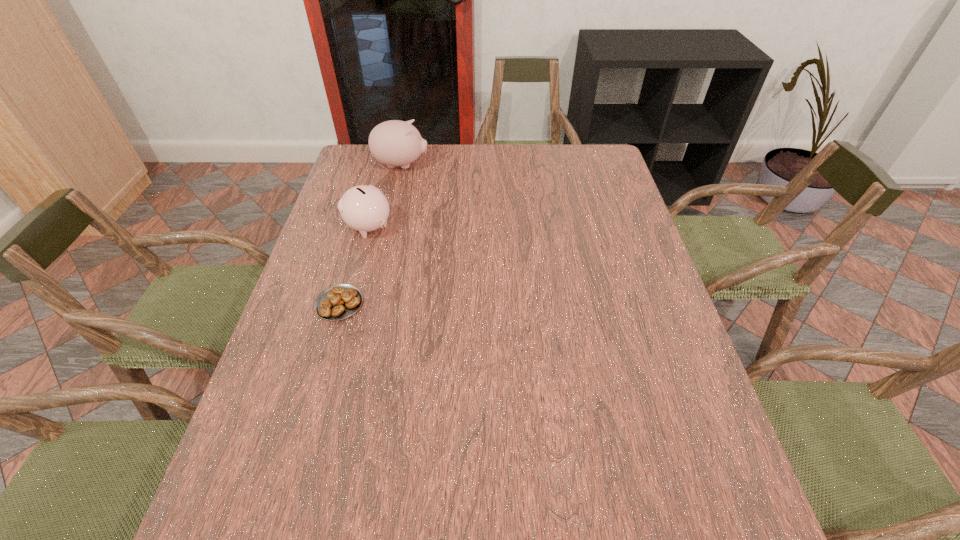
The width and height of the screenshot is (960, 540). Identify the location of vacant space that is in between the second tallest object and the pastry. (354, 265).

This screenshot has width=960, height=540. Find the location of `object that is the second closest to the shortest object`. object that is the second closest to the shortest object is located at coordinates (394, 143).

Choose which object is the nearest neighbor to the second farthest object. Please provide its 2D coordinates. Your answer should be formatted as a tuple, i.e. [(x, y)], where the tuple contains the x and y coordinates of a point satisfying the conditions above.

[(337, 302)]

This screenshot has height=540, width=960. I want to click on free space that satisfies the following two spatial constraints: 1. at the snout of the farther piggy bank; 2. on the front side of the second farthest object, so [x=387, y=227].

Find the location of a particular element. This screenshot has width=960, height=540. vacant region that satisfies the following two spatial constraints: 1. on the back side of the shorter piggy bank; 2. on the left side of the nearest object is located at coordinates (362, 227).